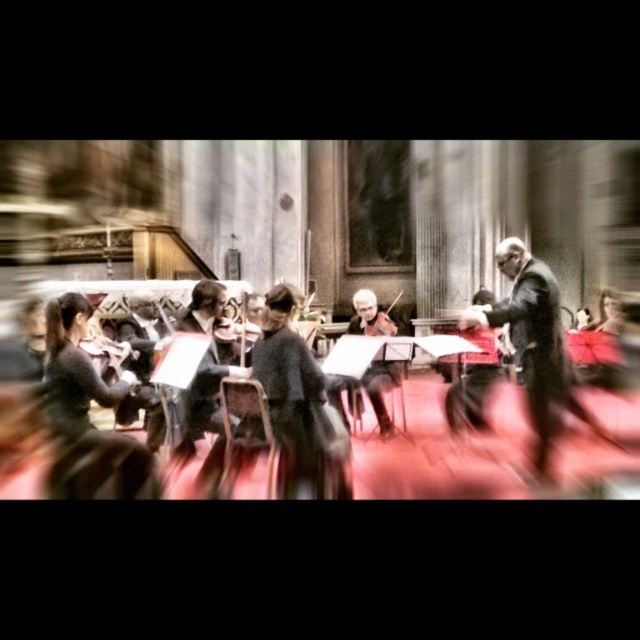
From the picture: Can you confirm if shiny black violin at center is smaller than wooden violin at center?

No.

Which of these two, shiny black violin at center or wooden violin at center, stands shorter?

wooden violin at center is shorter.

Who is more forward, (250, 328) or (392, 333)?

Positioned in front is point (250, 328).

You are a GUI agent. You are given a task and a screenshot of the screen. Output one action in this format:
    pyautogui.click(x=<x>, y=<y>)
    Task: Click on the shiny black violin at center
    This screenshot has width=640, height=640.
    Given the screenshot: What is the action you would take?
    [240, 323]

Is black glossy violin at center thinner than black suit at center?

No.

Does black glossy violin at center have a smaller size compared to black suit at center?

Incorrect, black glossy violin at center is not smaller in size than black suit at center.

Between point (636, 406) and point (531, 257), which one is positioned behind?

The point (531, 257) is behind.

You are a GUI agent. You are given a task and a screenshot of the screen. Output one action in this format:
    pyautogui.click(x=<x>, y=<y>)
    Task: Click on the black glossy violin at center
    The height and width of the screenshot is (640, 640).
    Given the screenshot: What is the action you would take?
    pyautogui.click(x=445, y=452)

Which is in front, point (550, 273) or point (248, 328)?

Point (550, 273)

Is point (552, 410) less distant than point (237, 314)?

That is True.

Image resolution: width=640 pixels, height=640 pixels. In order to click on black suit at center in this screenshot , I will do `click(534, 346)`.